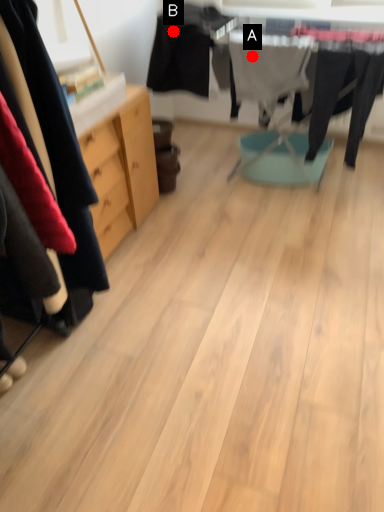
Question: Two points are circled on the image, labeled by A and B beside each circle. Which of the following is the farthest from the observer?

Choices:
 (A) A is further
 (B) B is further

Answer: (B)